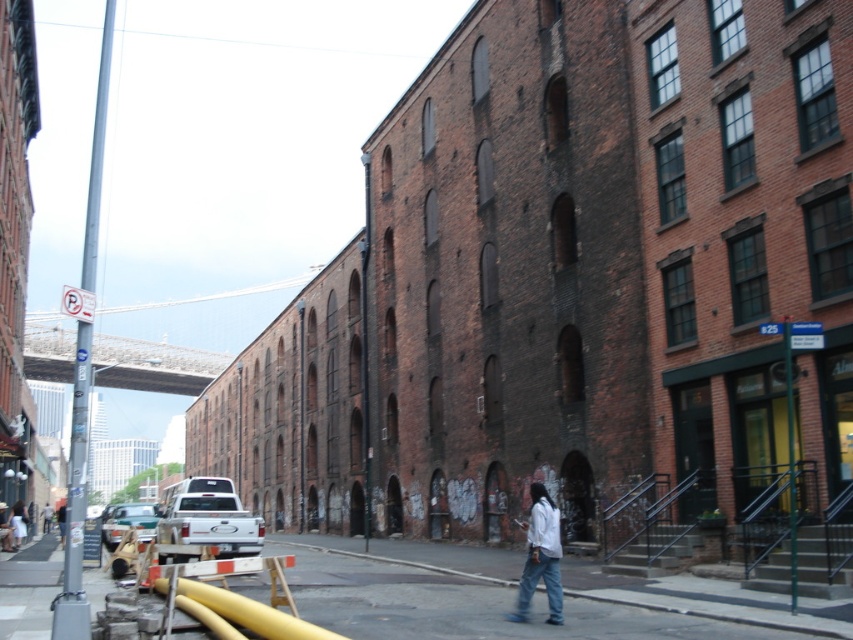
Is smooth asphalt road at center to the left of white matte shirt at center from the viewer's perspective?

Indeed, smooth asphalt road at center is positioned on the left side of white matte shirt at center.

Is the position of smooth asphalt road at center less distant than that of white matte shirt at center?

Yes, smooth asphalt road at center is closer to the viewer.

In order to click on smooth asphalt road at center in this screenshot , I will do `click(506, 596)`.